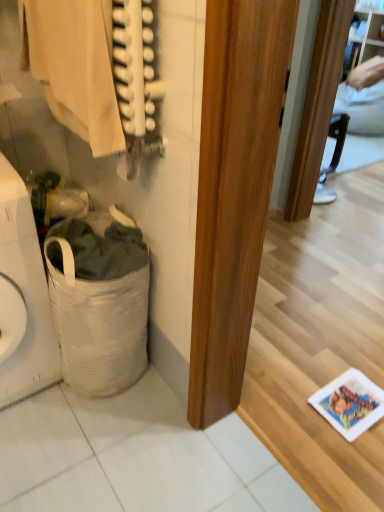
Question: Is white woven laundry basket at lower left to the left of light beige fabric at upper left from the viewer's perspective?

Choices:
 (A) yes
 (B) no

Answer: (A)

Question: Are white woven laundry basket at lower left and light beige fabric at upper left making contact?

Choices:
 (A) yes
 (B) no

Answer: (B)

Question: Is white woven laundry basket at lower left not close to light beige fabric at upper left?

Choices:
 (A) yes
 (B) no

Answer: (B)

Question: From the image's perspective, is white woven laundry basket at lower left over light beige fabric at upper left?

Choices:
 (A) no
 (B) yes

Answer: (A)

Question: From the image's perspective, is white woven laundry basket at lower left below light beige fabric at upper left?

Choices:
 (A) no
 (B) yes

Answer: (B)

Question: In terms of height, does white fabric laundry basket at lower left look taller or shorter compared to light beige fabric at upper left?

Choices:
 (A) short
 (B) tall

Answer: (B)

Question: From the image's perspective, relative to light beige fabric at upper left, is white fabric laundry basket at lower left above or below?

Choices:
 (A) above
 (B) below

Answer: (B)

Question: Looking at their shapes, would you say white fabric laundry basket at lower left is wider or thinner than light beige fabric at upper left?

Choices:
 (A) thin
 (B) wide

Answer: (B)

Question: Do you think white fabric laundry basket at lower left is within light beige fabric at upper left, or outside of it?

Choices:
 (A) outside
 (B) inside

Answer: (A)

Question: In the image, is light beige fabric at upper left positioned in front of or behind white woven laundry basket at lower left?

Choices:
 (A) front
 (B) behind

Answer: (A)

Question: Visually, is light beige fabric at upper left positioned to the left or to the right of white woven laundry basket at lower left?

Choices:
 (A) right
 (B) left

Answer: (A)

Question: Based on their sizes in the image, would you say light beige fabric at upper left is bigger or smaller than white woven laundry basket at lower left?

Choices:
 (A) big
 (B) small

Answer: (B)

Question: Is light beige fabric at upper left taller or shorter than white woven laundry basket at lower left?

Choices:
 (A) tall
 (B) short

Answer: (B)

Question: From the image's perspective, relative to light beige fabric at upper left, is white woven laundry basket at lower left above or below?

Choices:
 (A) below
 (B) above

Answer: (A)

Question: Looking at the image, does white woven laundry basket at lower left seem bigger or smaller compared to light beige fabric at upper left?

Choices:
 (A) big
 (B) small

Answer: (A)